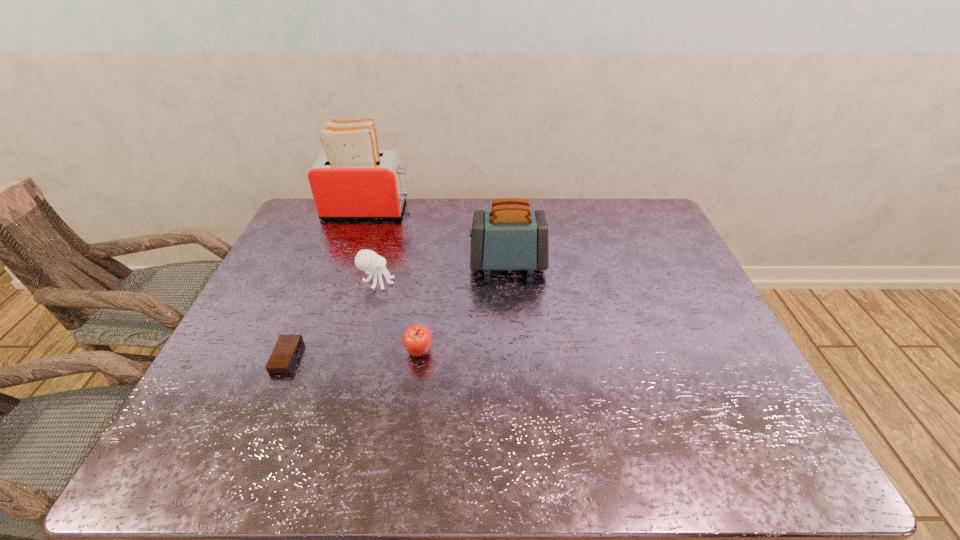
The image size is (960, 540). Find the location of `vacant point located between the nearer toaster and the fourth object from left to right`. vacant point located between the nearer toaster and the fourth object from left to right is located at coordinates (464, 308).

At what (x,y) coordinates should I click in order to perform the action: click on free space between the third tallest object and the apple. Please return your answer as a coordinate pair (x, y). The width and height of the screenshot is (960, 540). Looking at the image, I should click on pyautogui.click(x=398, y=316).

You are a GUI agent. You are given a task and a screenshot of the screen. Output one action in this format:
    pyautogui.click(x=<x>, y=<y>)
    Task: Click on the free spot between the alarm clock and the octopus
    This screenshot has width=960, height=540.
    Given the screenshot: What is the action you would take?
    pyautogui.click(x=332, y=319)

You are a GUI agent. You are given a task and a screenshot of the screen. Output one action in this format:
    pyautogui.click(x=<x>, y=<y>)
    Task: Click on the vacant area between the octopus and the shortest object
    The width and height of the screenshot is (960, 540).
    Given the screenshot: What is the action you would take?
    pyautogui.click(x=332, y=319)

Locate an element on the screen. This screenshot has height=540, width=960. free spot between the second shortest object and the tallest object is located at coordinates (394, 280).

Locate which object is the third closest to the second shortest object. Please provide its 2D coordinates. Your answer should be formatted as a tuple, i.e. [(x, y)], where the tuple contains the x and y coordinates of a point satisfying the conditions above.

[(283, 357)]

Locate which object is the second closest to the rightmost object. Please provide its 2D coordinates. Your answer should be formatted as a tuple, i.e. [(x, y)], where the tuple contains the x and y coordinates of a point satisfying the conditions above.

[(417, 339)]